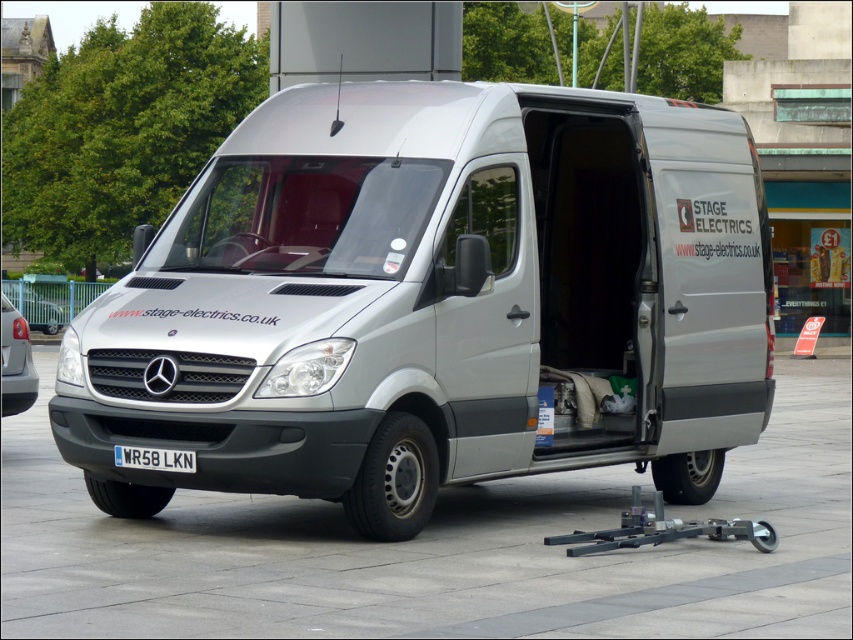
Question: Among these points, which one is farthest from the camera?

Choices:
 (A) (405, 419)
 (B) (19, 384)
 (C) (190, 472)

Answer: (B)

Question: Is satin silver van at center to the right of silver metallic van at left from the viewer's perspective?

Choices:
 (A) yes
 (B) no

Answer: (A)

Question: Is satin silver van at center below silver metallic van at left?

Choices:
 (A) no
 (B) yes

Answer: (A)

Question: Does satin silver van at center appear under silver metallic van at left?

Choices:
 (A) no
 (B) yes

Answer: (A)

Question: Which object is the closest to the white plastic license plate at center?

Choices:
 (A) satin silver van at center
 (B) silver metallic van at left

Answer: (A)

Question: Which point is closer to the camera taking this photo?

Choices:
 (A) (173, 464)
 (B) (621, 458)
 (C) (35, 378)

Answer: (A)